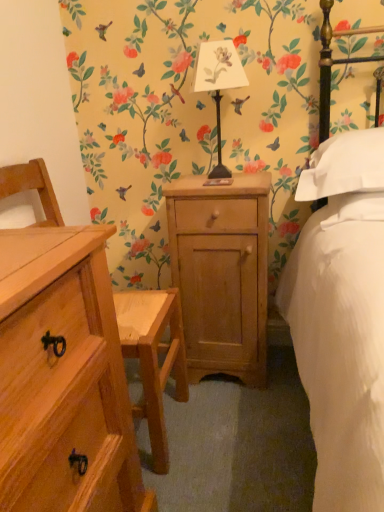
Question: Can you confirm if natural wood cabinet at center is shorter than white soft pillow at right, the first pillow from the top?

Choices:
 (A) yes
 (B) no

Answer: (B)

Question: From the image's perspective, is natural wood cabinet at center above white soft pillow at right, placed as the 2th pillow when sorted from bottom to top?

Choices:
 (A) no
 (B) yes

Answer: (A)

Question: Can you confirm if natural wood cabinet at center is smaller than white soft pillow at right, the first pillow from the top?

Choices:
 (A) yes
 (B) no

Answer: (B)

Question: Can we say natural wood cabinet at center lies outside white soft pillow at right, placed as the 2th pillow when sorted from bottom to top?

Choices:
 (A) yes
 (B) no

Answer: (A)

Question: Is natural wood cabinet at center at the left side of white soft pillow at right, placed as the 2th pillow when sorted from bottom to top?

Choices:
 (A) yes
 (B) no

Answer: (A)

Question: From the image's perspective, is natural wood chest of drawers at left located above or below white soft pillow at upper right, placed as the second pillow when sorted from top to bottom?

Choices:
 (A) above
 (B) below

Answer: (B)

Question: Is natural wood chest of drawers at left taller or shorter than white soft pillow at upper right, which is the 1th pillow in bottom-to-top order?

Choices:
 (A) short
 (B) tall

Answer: (B)

Question: From a real-world perspective, is natural wood chest of drawers at left physically located above or below white soft pillow at upper right, placed as the second pillow when sorted from top to bottom?

Choices:
 (A) above
 (B) below

Answer: (B)

Question: Choose the correct answer: Is natural wood chest of drawers at left inside white soft pillow at upper right, placed as the second pillow when sorted from top to bottom, or outside it?

Choices:
 (A) outside
 (B) inside

Answer: (A)

Question: Is point (374, 176) closer or farther from the camera than point (54, 467)?

Choices:
 (A) farther
 (B) closer

Answer: (A)

Question: Relative to natural wood chest of drawers at left, is white soft pillow at right, the first pillow from the top, in front or behind?

Choices:
 (A) behind
 (B) front

Answer: (A)

Question: Would you say white soft pillow at right, placed as the 2th pillow when sorted from bottom to top, is to the left or to the right of natural wood chest of drawers at left in the picture?

Choices:
 (A) right
 (B) left

Answer: (A)

Question: From a real-world perspective, is white soft pillow at right, the first pillow from the top, physically located above or below natural wood chest of drawers at left?

Choices:
 (A) below
 (B) above

Answer: (B)

Question: Would you say white soft pillow at upper right, placed as the second pillow when sorted from top to bottom, is inside or outside metallic black lamp at center?

Choices:
 (A) outside
 (B) inside

Answer: (A)

Question: Is point (349, 203) positioned closer to the camera than point (218, 72)?

Choices:
 (A) closer
 (B) farther

Answer: (A)